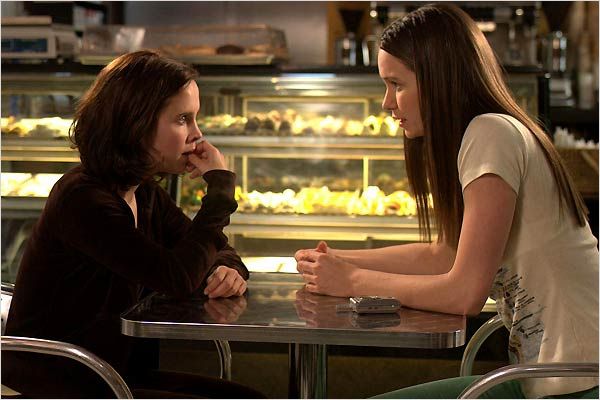
Identify the location of table. (301, 306).